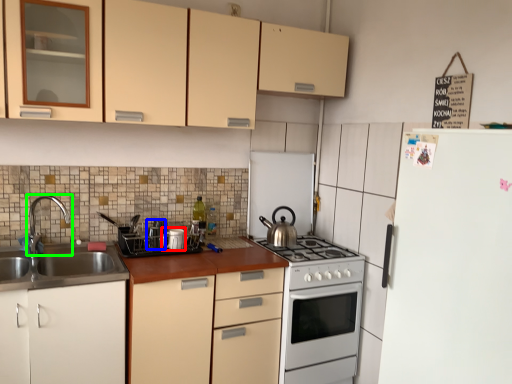
Question: Based on their relative distances, which object is farther from appliance (highlighted by a red box)? Choose from appliance (highlighted by a blue box) and tap (highlighted by a green box).

Choices:
 (A) appliance
 (B) tap

Answer: (B)